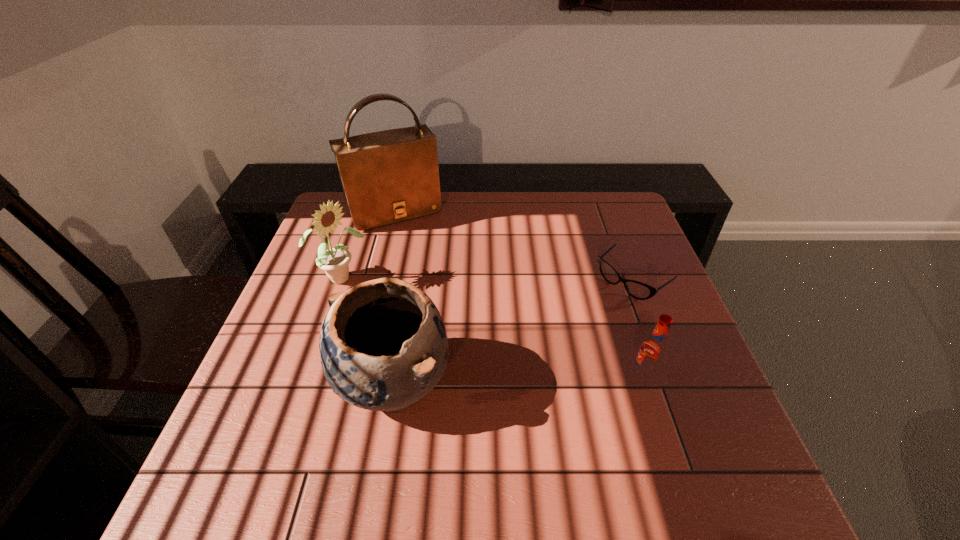
The width and height of the screenshot is (960, 540). In order to click on vacant space on the desktop that is between the pottery and the fourth tallest object and is positioned on the front flap of the shoulder bag in this screenshot , I will do `click(484, 381)`.

You are a GUI agent. You are given a task and a screenshot of the screen. Output one action in this format:
    pyautogui.click(x=<x>, y=<y>)
    Task: Click on the vacant space on the desktop that is between the pottery and the root beer and is positioned on the front-facing side of the sunflower
    
    Given the screenshot: What is the action you would take?
    pyautogui.click(x=509, y=380)

At what (x,y) coordinates should I click in order to perform the action: click on vacant space on the desktop that is between the pottery and the second shortest object and is positioned on the front-facing side of the spectacles. Please return your answer as a coordinate pair (x, y). This screenshot has width=960, height=540. Looking at the image, I should click on (509, 380).